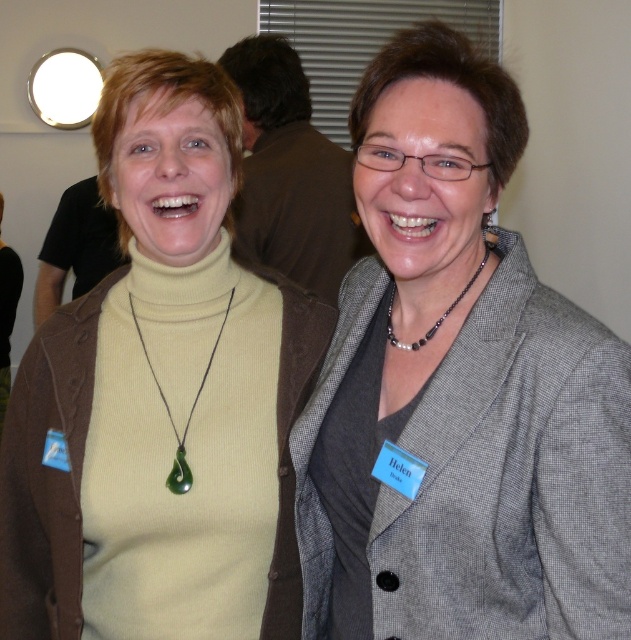
You are a photographer setting up for a group photo. You need to ensure that the black beaded necklace at center is visible in the final shot. Based on their positions, should you adjust the gray woolen blazer at upper right to move it slightly backward?

Yes, the gray woolen blazer at upper right is currently in front of the black beaded necklace at center, so moving it backward would allow the necklace to be visible.

You are a photographer adjusting your camera settings to capture the best shot of the two people in the image. You notice two necklaces at the center of the frame. Which necklace is positioned to the left when looking at the green jade pendant at center and the black beaded necklace at center?

The green jade pendant at center is positioned to the left of the black beaded necklace at center.

Looking at this image, you are standing at the point marked by coordinates point (543, 429) and want to take a photo of the two people in the scene with your camera, which has a maximum focus range of 30 inches. Will the camera be able to focus on the two people?

The distance between point (543, 429) and the camera is 33.25 inches, which exceeds the camera maximum focus range of 30 inches. Therefore, the camera will not be able to focus on the two people.